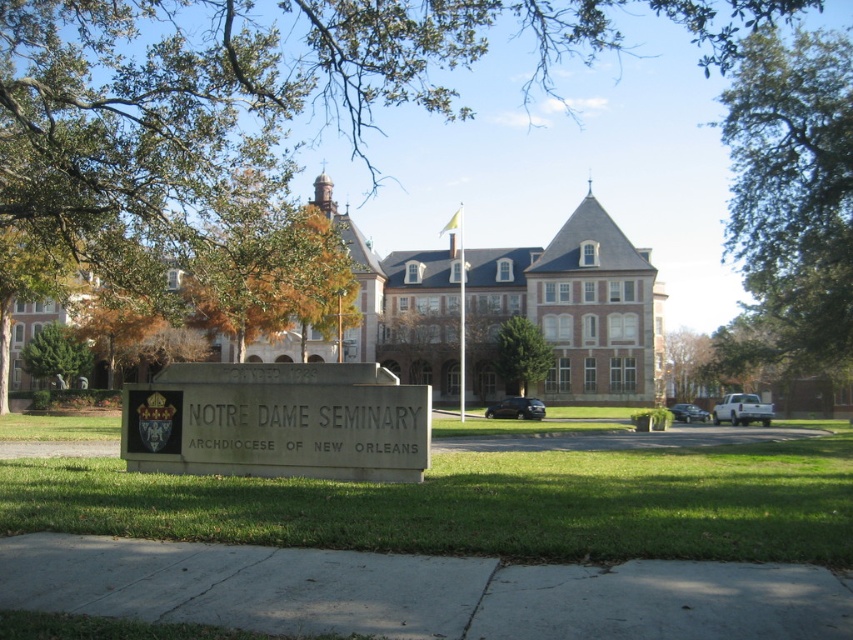
Image resolution: width=853 pixels, height=640 pixels. Find the location of `green leafy tree at upper right`. green leafy tree at upper right is located at coordinates (790, 202).

Which is in front, point (816, 154) or point (27, 340)?

Point (816, 154) is in front.

You are a GUI agent. You are given a task and a screenshot of the screen. Output one action in this format:
    pyautogui.click(x=<x>, y=<y>)
    Task: Click on the green leafy tree at upper right
    Image resolution: width=853 pixels, height=640 pixels.
    Given the screenshot: What is the action you would take?
    pos(790,202)

Does green leafy tree at upper center lie behind green leafy tree at center?

No, green leafy tree at upper center is in front of green leafy tree at center.

Does green leafy tree at upper center have a greater height compared to green leafy tree at center?

Indeed, green leafy tree at upper center has a greater height compared to green leafy tree at center.

Is point (433, 19) positioned before point (515, 352)?

Yes, it is.

Locate an element on the screen. green leafy tree at upper center is located at coordinates (248, 96).

How much distance is there between gray stone sign at center and green leafy tree at upper left?

They are 89.04 meters apart.

I want to click on gray stone sign at center, so click(277, 420).

Between point (338, 381) and point (44, 364), which one is positioned in front?

Positioned in front is point (338, 381).

The width and height of the screenshot is (853, 640). In order to click on gray stone sign at center in this screenshot , I will do `click(277, 420)`.